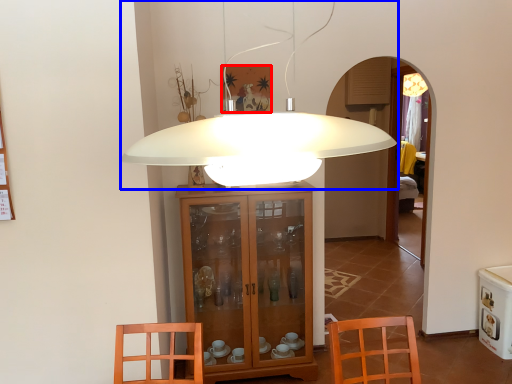
Question: Among these objects, which one is farthest to the camera, picture frame (highlighted by a red box) or lamp (highlighted by a blue box)?

Choices:
 (A) picture frame
 (B) lamp

Answer: (A)